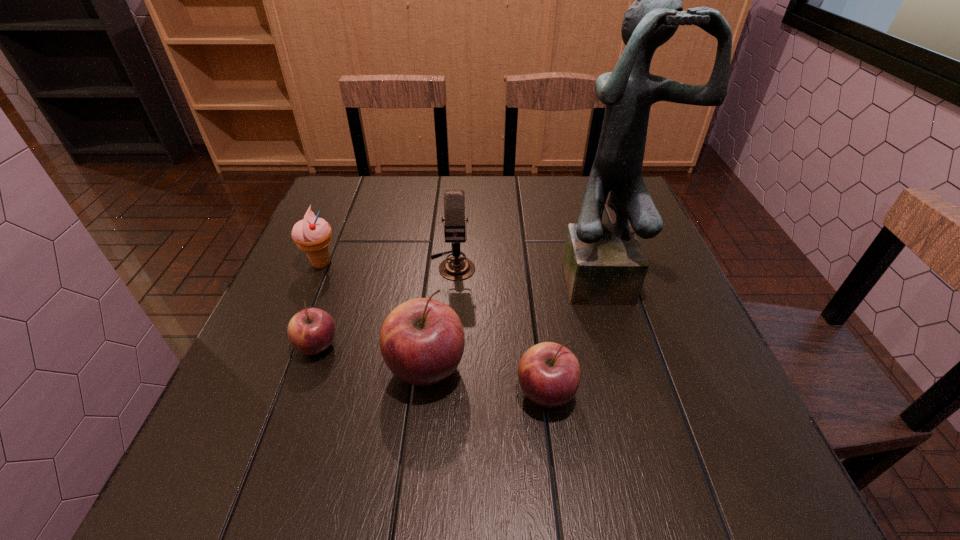
Where is `the leftmost apple`? This screenshot has width=960, height=540. the leftmost apple is located at coordinates (311, 331).

The width and height of the screenshot is (960, 540). What are the coordinates of `the shortest apple` in the screenshot? It's located at (311, 331).

Identify the location of the second apple from right to left. (422, 340).

Find the location of `the fifth tallest object`. the fifth tallest object is located at coordinates (549, 374).

Locate an element on the screen. This screenshot has height=540, width=960. the rightmost apple is located at coordinates (549, 374).

Locate an element on the screen. sculpture is located at coordinates (604, 264).

Find the location of a particular element. the rightmost object is located at coordinates (604, 264).

The image size is (960, 540). I want to click on microphone, so click(456, 268).

Find the location of a particular element. This screenshot has width=960, height=540. icecream is located at coordinates (312, 234).

Identify the location of blank space located on the back of the leftmost apple. The height and width of the screenshot is (540, 960). (348, 261).